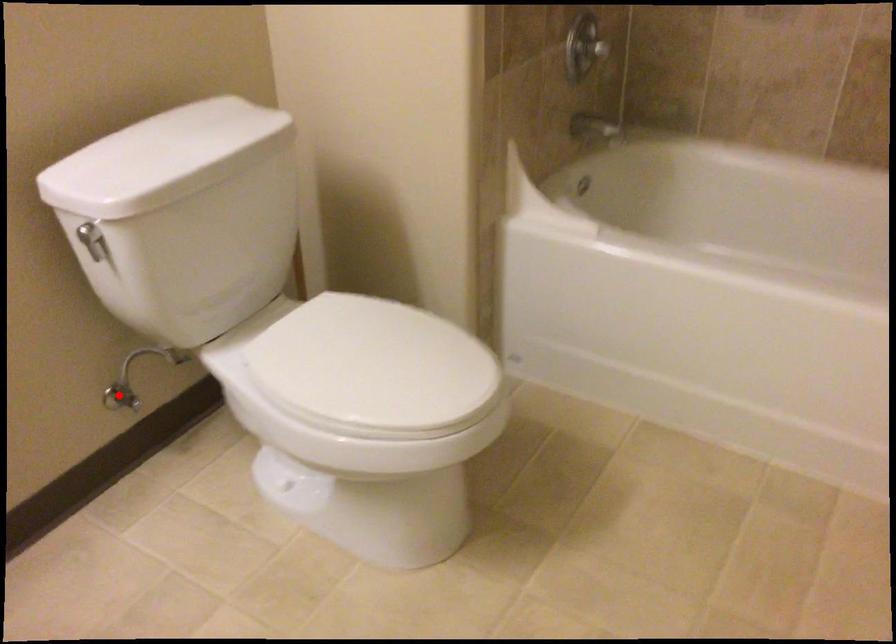
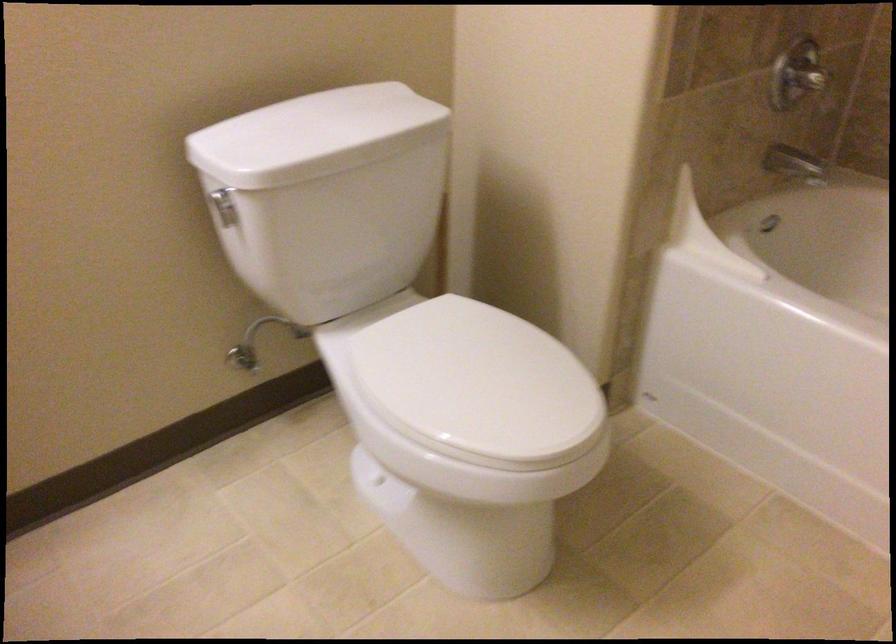
Locate, in the second image, the point that corresponds to the highlighted location in the first image.

(243, 357)